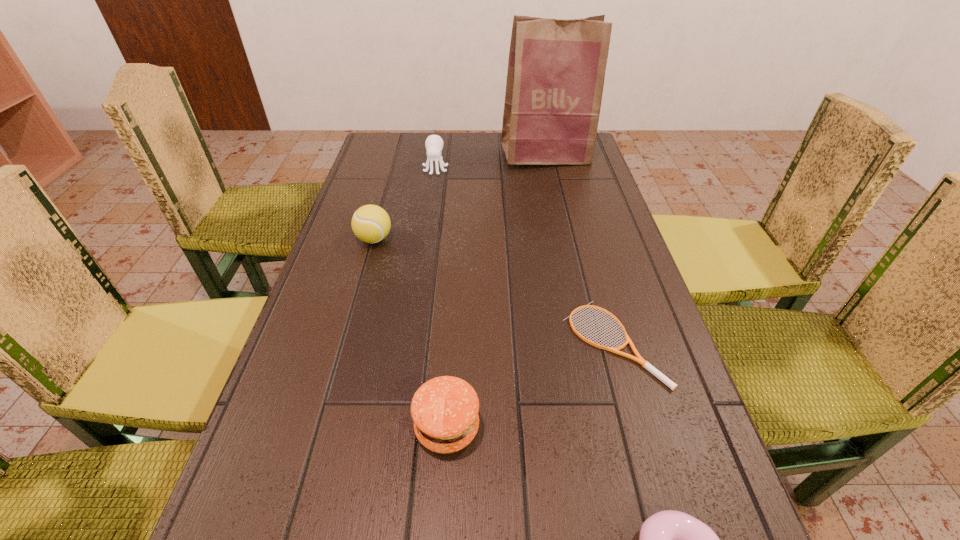
Where is `vacant space located 0.110m on the left of the patty`? The height and width of the screenshot is (540, 960). vacant space located 0.110m on the left of the patty is located at coordinates (350, 427).

You are a GUI agent. You are given a task and a screenshot of the screen. Output one action in this format:
    pyautogui.click(x=<x>, y=<y>)
    Task: Click on the vacant point located 0.280m on the left of the fourth farthest object
    The height and width of the screenshot is (540, 960).
    Given the screenshot: What is the action you would take?
    pyautogui.click(x=427, y=343)

This screenshot has height=540, width=960. I want to click on grocery bag present at the far edge, so (556, 68).

Locate an element on the screen. The width and height of the screenshot is (960, 540). octopus positioned at the far edge is located at coordinates (x=434, y=143).

Identify the location of object that is at the left edge. (370, 223).

Locate an element on the screen. This screenshot has width=960, height=540. grocery bag located at the right edge is located at coordinates (556, 68).

Find the location of a particular element. The height and width of the screenshot is (540, 960). tennis racket present at the right edge is located at coordinates (638, 358).

Where is `object at the far right corner`? object at the far right corner is located at coordinates (556, 68).

Locate an element on the screen. This screenshot has width=960, height=540. vacant space at the far edge of the desktop is located at coordinates (490, 157).

The width and height of the screenshot is (960, 540). In order to click on vacant space at the left edge in this screenshot , I will do `click(390, 176)`.